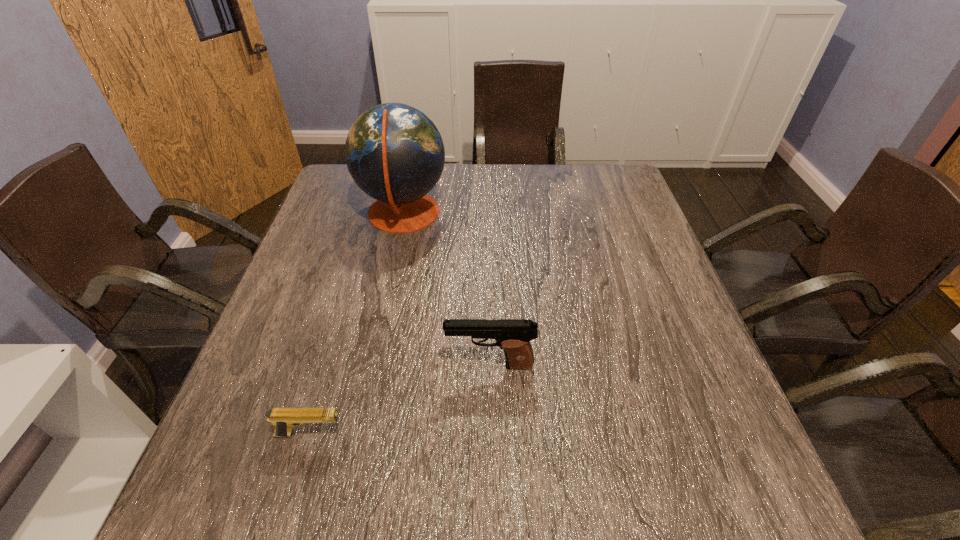
Where is `the closest object to the left pistol`? The height and width of the screenshot is (540, 960). the closest object to the left pistol is located at coordinates (513, 336).

Locate which object is the second closest to the shortest object. Please provide its 2D coordinates. Your answer should be formatted as a tuple, i.e. [(x, y)], where the tuple contains the x and y coordinates of a point satisfying the conditions above.

[(395, 154)]